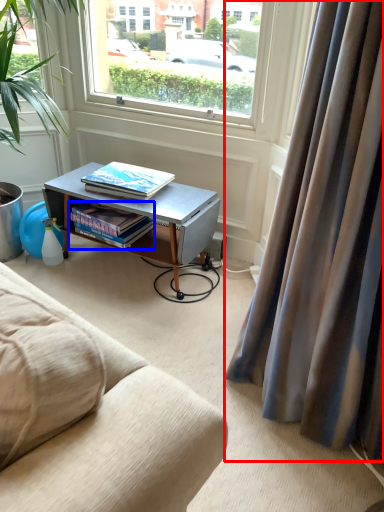
Question: Which point is closer to the camera, curtain (highlighted by a red box) or book (highlighted by a blue box)?

Choices:
 (A) curtain
 (B) book

Answer: (A)